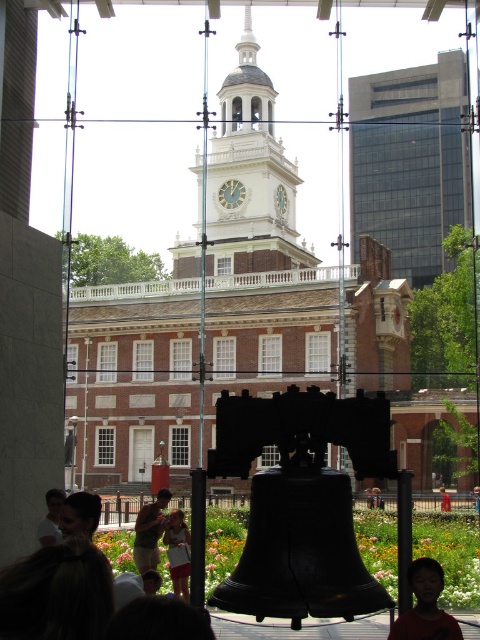
Between point (442, 614) and point (228, 196), which one is positioned behind?

The point (228, 196) is behind.

Find the location of a particular element. The image size is (480, 640). matte red shirt at lower right is located at coordinates (424, 605).

Image resolution: width=480 pixels, height=640 pixels. Identify the location of matte red shirt at lower right. (424, 605).

Is brown wood pillar at lower center above light brown hair at lower center?

Yes, brown wood pillar at lower center is above light brown hair at lower center.

The image size is (480, 640). What do you see at coordinates (197, 536) in the screenshot? I see `brown wood pillar at lower center` at bounding box center [197, 536].

Identify the location of brown wood pillar at lower center. The height and width of the screenshot is (640, 480). (197, 536).

Who is positioned more to the right, tan cotton shirt at center or brown fabric shirt at lower right?

brown fabric shirt at lower right is more to the right.

Between point (147, 547) and point (447, 506), which one is positioned in front?

Point (147, 547) is more forward.

The height and width of the screenshot is (640, 480). Find the location of `tan cotton shirt at center`. tan cotton shirt at center is located at coordinates (149, 531).